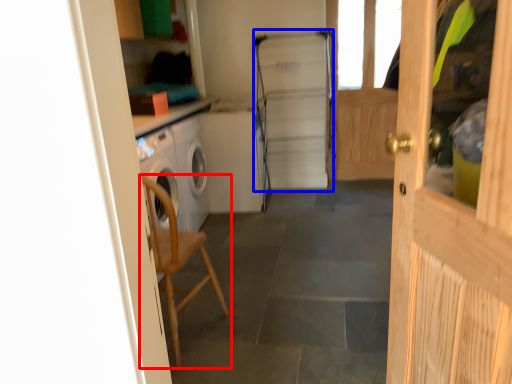
Question: Which object is further to the camera taking this photo, chair (highlighted by a red box) or fridge (highlighted by a blue box)?

Choices:
 (A) chair
 (B) fridge

Answer: (B)